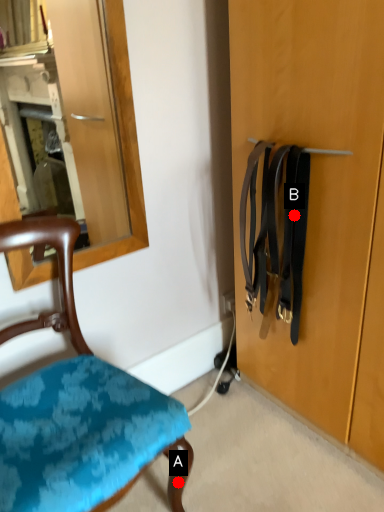
Question: Two points are circled on the image, labeled by A and B beside each circle. Which point appears closest to the camera in this image?

Choices:
 (A) A is closer
 (B) B is closer

Answer: (A)